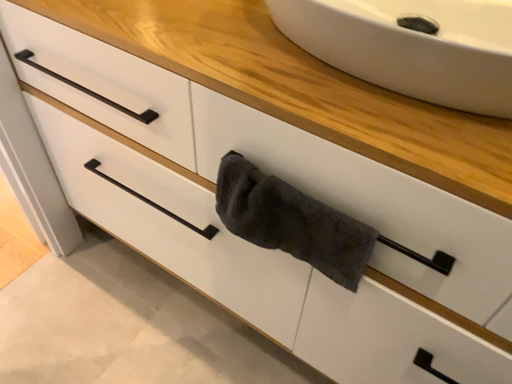
Question: From the image's perspective, is dark gray terry cloth towel at center above or below white ceramic sink at upper center?

Choices:
 (A) below
 (B) above

Answer: (A)

Question: Is dark gray terry cloth towel at center spatially inside white ceramic sink at upper center, or outside of it?

Choices:
 (A) outside
 (B) inside

Answer: (A)

Question: Would you say dark gray terry cloth towel at center is to the left or to the right of white ceramic sink at upper center in the picture?

Choices:
 (A) left
 (B) right

Answer: (A)

Question: From the image's perspective, relative to dark gray terry cloth towel at center, is white ceramic sink at upper center above or below?

Choices:
 (A) above
 (B) below

Answer: (A)

Question: Visually, is white ceramic sink at upper center positioned to the left or to the right of dark gray terry cloth towel at center?

Choices:
 (A) left
 (B) right

Answer: (B)

Question: Choose the correct answer: Is white ceramic sink at upper center inside dark gray terry cloth towel at center or outside it?

Choices:
 (A) outside
 (B) inside

Answer: (A)

Question: Based on their sizes in the image, would you say white ceramic sink at upper center is bigger or smaller than dark gray terry cloth towel at center?

Choices:
 (A) small
 (B) big

Answer: (B)